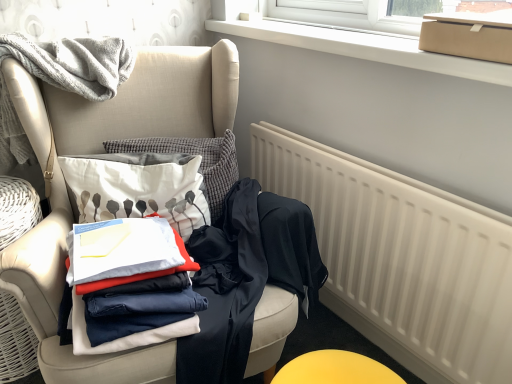
Question: Is matte cardboard box at upper right spatially inside dark blue fabric pants at center, acting as the 2th clothing starting from the left, or outside of it?

Choices:
 (A) inside
 (B) outside

Answer: (B)

Question: Considering their positions, is matte cardboard box at upper right located in front of or behind dark blue fabric pants at center, acting as the 2th clothing starting from the left?

Choices:
 (A) front
 (B) behind

Answer: (A)

Question: Which object is positioned closest to the dark blue fabric pants at center, acting as the 2th clothing starting from the left?

Choices:
 (A) white plastic window frame at upper center
 (B) matte cardboard box at upper right
 (C) white cotton pillow at center
 (D) white cotton shirt at center, marked as the third clothing in a right-to-left arrangement
 (E) white matte radiator at lower right

Answer: (D)

Question: Estimate the real-world distances between objects in this image. Which object is farther from the white cotton shirt at center, marked as the third clothing in a right-to-left arrangement?

Choices:
 (A) matte beige armchair at left
 (B) dark blue fabric pants at center, acting as the 2th clothing starting from the left
 (C) matte cardboard box at upper right
 (D) dark blue fabric at chair, the first clothing when ordered from right to left
 (E) white plastic window frame at upper center

Answer: (C)